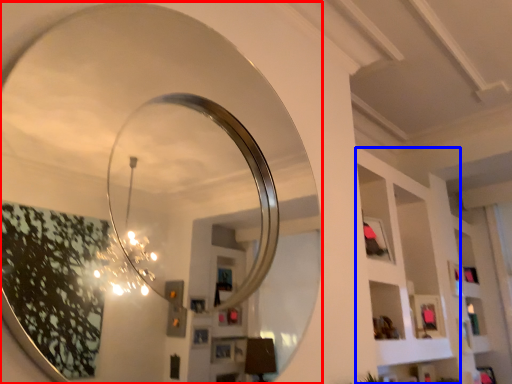
Question: Which object appears farthest to the camera in this image, mirror (highlighted by a red box) or shelf (highlighted by a blue box)?

Choices:
 (A) mirror
 (B) shelf

Answer: (B)